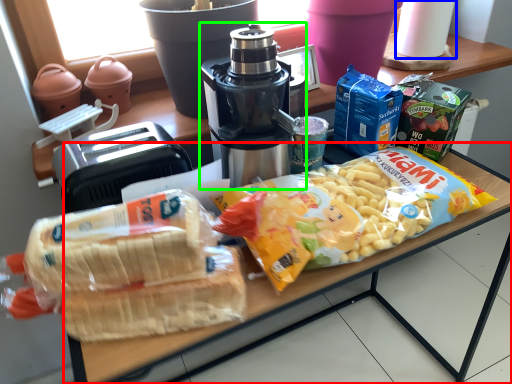
Question: Which object is the farthest from table (highlighted by a red box)? Choose among these: paper towel (highlighted by a blue box) or coffee maker (highlighted by a green box).

Choices:
 (A) paper towel
 (B) coffee maker

Answer: (A)